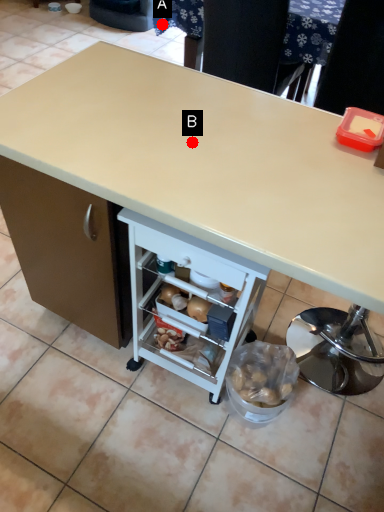
Question: Two points are circled on the image, labeled by A and B beside each circle. Which of the following is the farthest from the observer?

Choices:
 (A) A is further
 (B) B is further

Answer: (A)